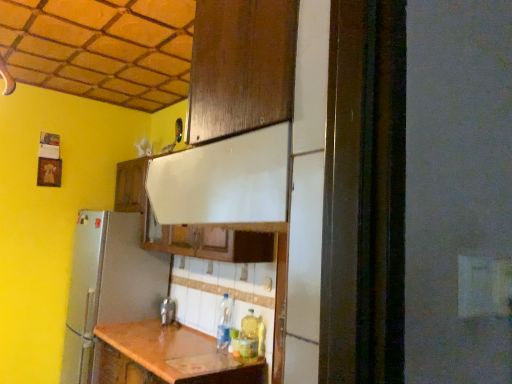
Question: Considering the positions of point (244, 342) and point (229, 301), is point (244, 342) closer or farther from the camera than point (229, 301)?

Choices:
 (A) farther
 (B) closer

Answer: (B)

Question: Visually, is translucent plastic bottle at lower center, which is the first bottle in front-to-back order, positioned to the left or to the right of clear plastic bottle at center, which is counted as the 2th bottle, starting from the right?

Choices:
 (A) left
 (B) right

Answer: (B)

Question: Which object is the closest to the translucent plastic bottle at lower center, acting as the second bottle starting from the back?

Choices:
 (A) wooden cabinet at upper center
 (B) clear plastic bottle at center, which is counted as the 2th bottle, starting from the right
 (C) metallic silver faucet at center

Answer: (B)

Question: Which object is the closest to the translucent plastic bottle at lower center, which is the first bottle in front-to-back order?

Choices:
 (A) clear plastic bottle at center, the 2th bottle in the front-to-back sequence
 (B) metallic silver faucet at center
 (C) wooden cabinet at upper center

Answer: (A)